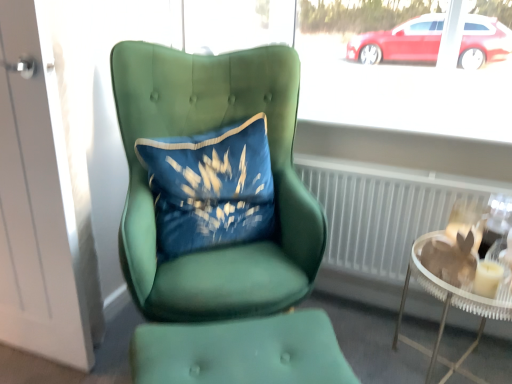
The height and width of the screenshot is (384, 512). Identify the location of vacant space in front of white matte door at left. (89, 367).